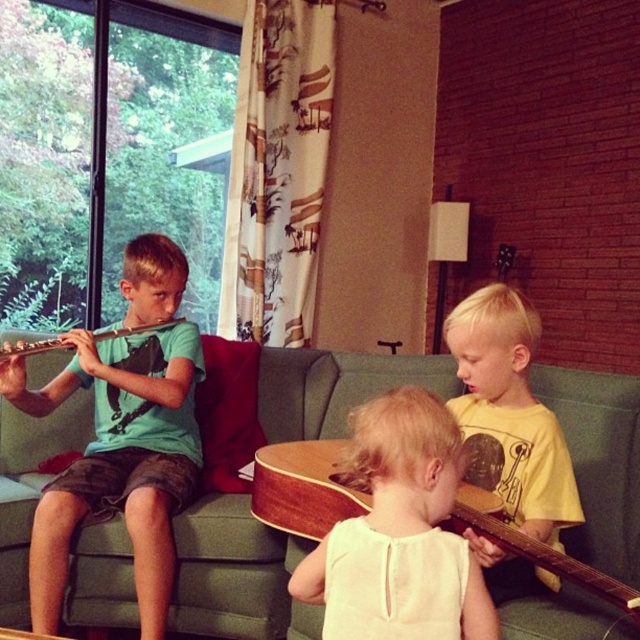
Can you confirm if green matte t-shirt at left is positioned below light blonde hair at center?

Incorrect, green matte t-shirt at left is not positioned below light blonde hair at center.

Is point (52, 557) less distant than point (323, 538)?

That is False.

Which is in front, point (145, 600) or point (339, 577)?

Point (339, 577) is in front.

I want to click on green matte t-shirt at left, so click(116, 460).

In the scene shown: Can you confirm if green fabric couch at center is smaller than wooden acoustic guitar at center?

Incorrect, green fabric couch at center is not smaller in size than wooden acoustic guitar at center.

Consider the image. Who is more distant from viewer, [237,544] or [310,484]?

Point [237,544]

You are a GUI agent. You are given a task and a screenshot of the screen. Output one action in this format:
    pyautogui.click(x=<x>, y=<y>)
    Task: Click on the green fabric couch at center
    This screenshot has height=640, width=640.
    Given the screenshot: What is the action you would take?
    pyautogui.click(x=236, y=573)

Is point (12, 509) positioned before point (99, 460)?

Yes, point (12, 509) is in front of point (99, 460).

Who is taller, green fabric couch at center or green matte t-shirt at left?

green matte t-shirt at left is taller.

Who is more forward, (120, 540) or (195, 440)?

Point (120, 540)

Locate an element on the screen. Image resolution: width=640 pixels, height=640 pixels. green fabric couch at center is located at coordinates (236, 573).